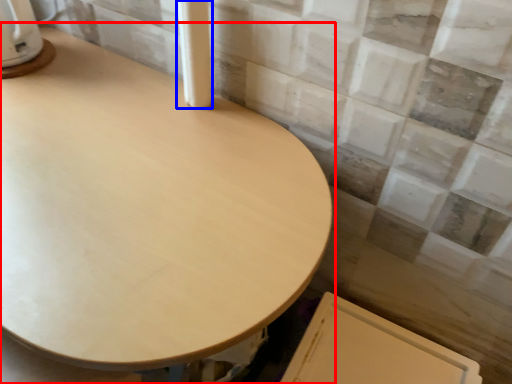
Question: Which object appears farthest to the camera in this image, table (highlighted by a red box) or pillar (highlighted by a blue box)?

Choices:
 (A) table
 (B) pillar

Answer: (B)